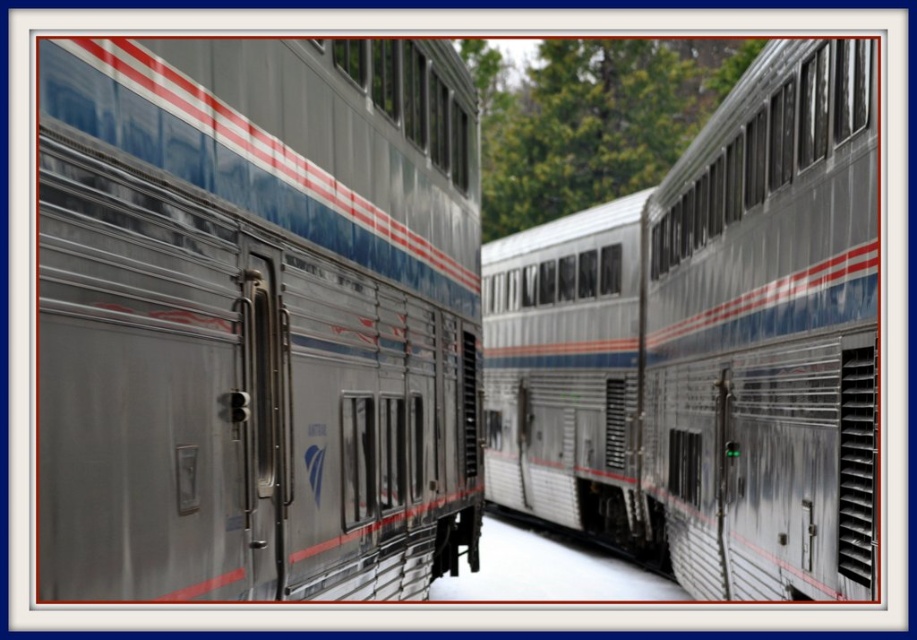
Describe the element at coordinates (256, 317) in the screenshot. I see `polished silver train at center` at that location.

Can you confirm if polished silver train at center is taller than silver metallic train at center?

Incorrect, polished silver train at center's height is not larger of silver metallic train at center's.

Who is more forward, (479,355) or (634,211)?

Point (479,355) is in front.

You are a GUI agent. You are given a task and a screenshot of the screen. Output one action in this format:
    pyautogui.click(x=<x>, y=<y>)
    Task: Click on the polished silver train at center
    Image resolution: width=917 pixels, height=640 pixels.
    Given the screenshot: What is the action you would take?
    pyautogui.click(x=256, y=317)